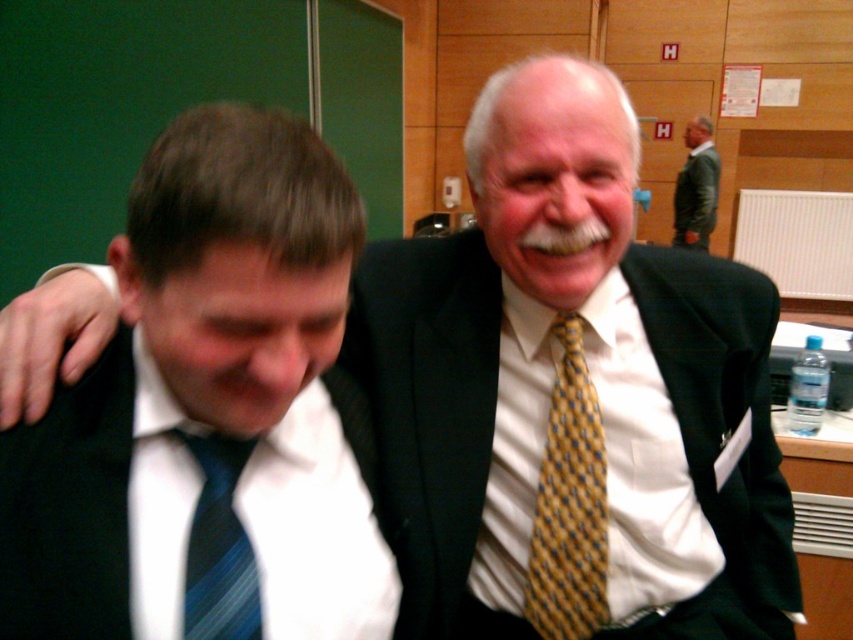
Question: Is matte black suit at left above yellow dotted tie at center?

Choices:
 (A) no
 (B) yes

Answer: (B)

Question: Which point is farther to the camera?

Choices:
 (A) (297, 554)
 (B) (204, 531)
 (C) (692, 196)

Answer: (C)

Question: Does matte black suit at left lie in front of blue striped tie at left?

Choices:
 (A) no
 (B) yes

Answer: (B)

Question: Which point is farther to the camera?

Choices:
 (A) green leather jacket at upper right
 (B) yellow dotted tie at center
 (C) blue striped tie at left

Answer: (A)

Question: Is yellow dotted tie at center below blue striped tie at left?

Choices:
 (A) no
 (B) yes

Answer: (B)

Question: Which point is farther to the camera?

Choices:
 (A) pos(59,483)
 (B) pos(527,620)
 (C) pos(695,160)
 (D) pos(218,627)

Answer: (C)